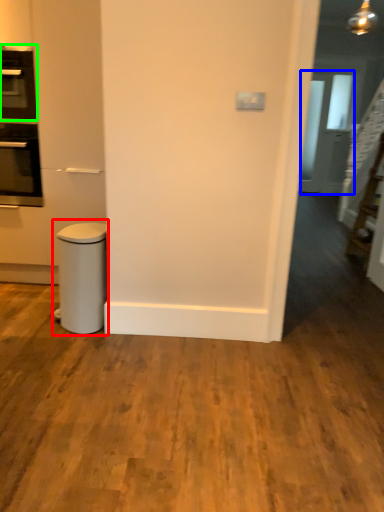
Question: Which object is positioned closest to waste container (highlighted by a red box)? Select from glass door (highlighted by a blue box) and home appliance (highlighted by a green box).

Choices:
 (A) glass door
 (B) home appliance

Answer: (B)